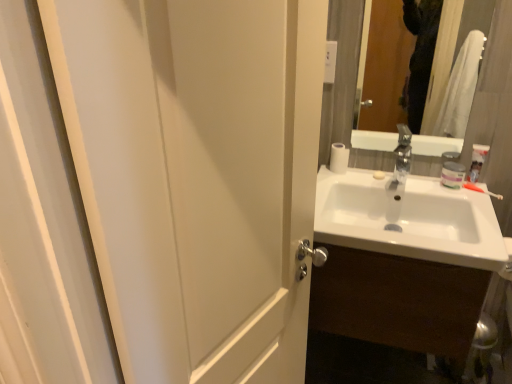
Question: Considering the positions of white matte door at left and white glossy sink at right in the image, is white matte door at left bigger or smaller than white glossy sink at right?

Choices:
 (A) small
 (B) big

Answer: (A)

Question: In the image, is white matte door at left positioned in front of or behind white glossy sink at right?

Choices:
 (A) behind
 (B) front

Answer: (B)

Question: Which object is positioned closest to the orange plastic toothbrush at right?

Choices:
 (A) white matte toilet paper at upper right
 (B) glossy glass mirror at upper right
 (C) white matte door at left
 (D) white glossy sink at right
 (E) white glossy toothpaste at upper right

Answer: (E)

Question: Which of these objects is positioned farthest from the glossy glass mirror at upper right?

Choices:
 (A) white matte toilet paper at upper right
 (B) white matte jar at upper right
 (C) white glossy sink at right
 (D) white matte door at left
 (E) white glossy toothpaste at upper right

Answer: (D)